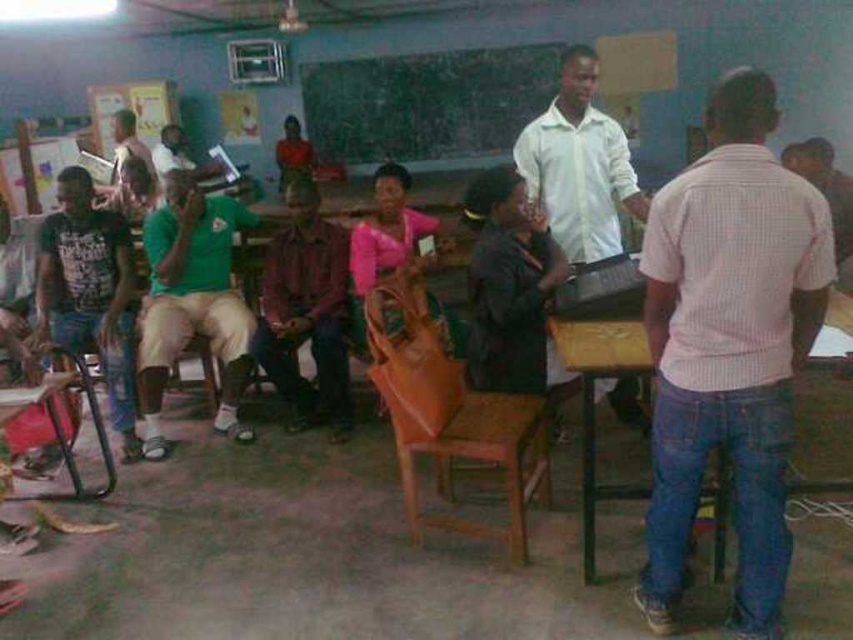
You are a photographer standing in the classroom. You want to take a photo that includes both the white matte shirt at center and the green fabric shirt at upper left. Which shirt should you adjust to ensure both are visible in the frame?

The white matte shirt at center is located below the green fabric shirt at upper left. To ensure both are visible, you should adjust the green fabric shirt at upper left to move it downward or the white matte shirt at center to move it upward.

Based on the photo, you are standing at the entrance of the classroom and want to locate the white matte shirt at center. According to the coordinates given, in which direction should you look to find it?

The white matte shirt at center is located at coordinates point (579, 164). Since the coordinate system typically has (0, 0) at the bottom left corner, this position would be slightly to the right and up from the bottom left corner, so you should look towards the lower middle area of the image.

You are standing at the entrance of the classroom and want to move to the brown woven chair at center. According to the coordinates provided, in which direction should you walk to reach it?

The brown woven chair at center is located at coordinates point (450, 413). Since the coordinate system is not specified, it is recommended to consult a map or ask for directions to ensure you walk in the correct direction.